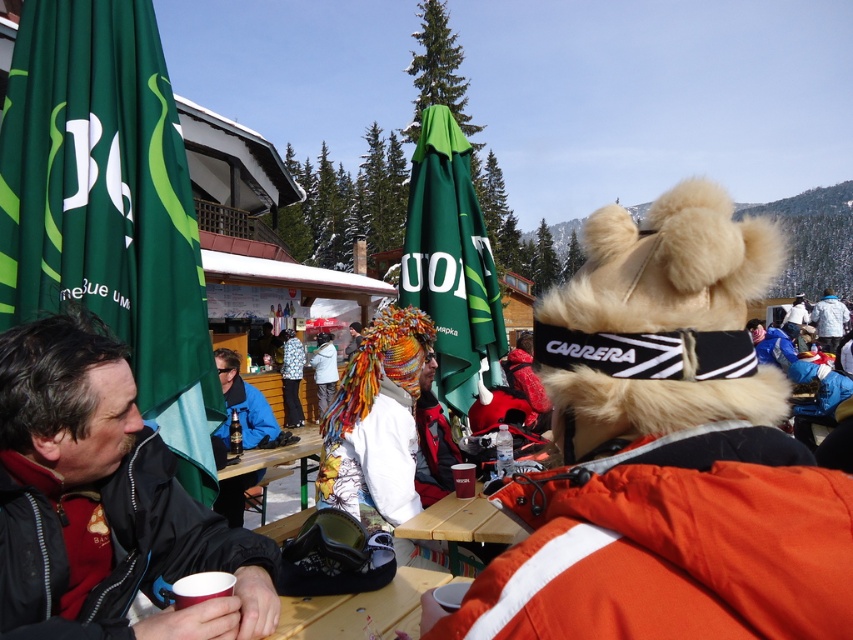
You are standing at the center of the scene and want to locate the green fabric flag at left. In which direction should you look to find it?

The green fabric flag at left is located at point [108,208], so you should look to the left to find it.

You are a delivery robot with a width of 1 meter. You need to move from your current position near the green fabric flag at left to the wooden table at center to drop off a package. Is there enough space for you to navigate through the area between them?

The distance between the green fabric flag at left and the wooden table at center is 1.49 meters. Since the robot is 1 meter wide, there is sufficient space for it to navigate through the area between them as the distance is greater than the robot width.